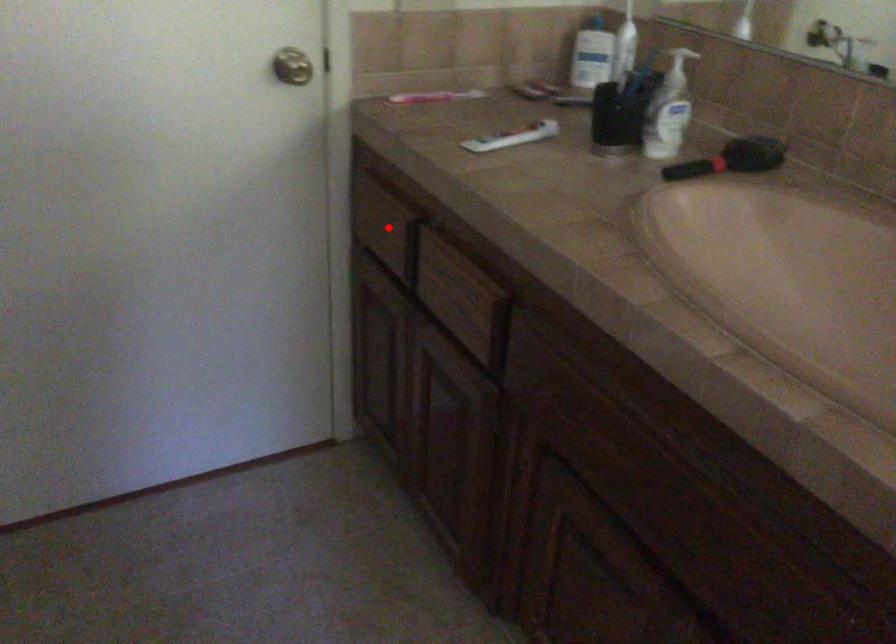
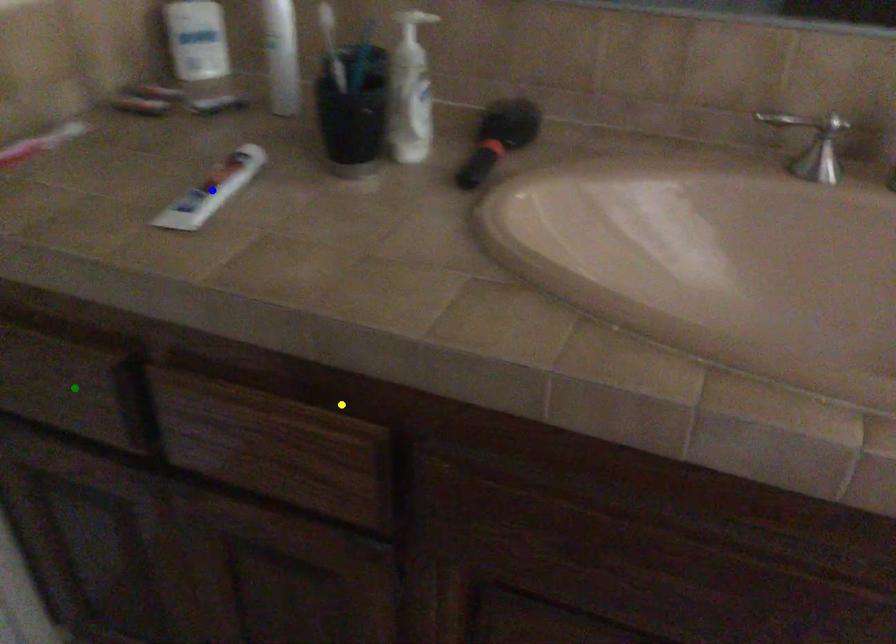
Question: I am providing you with two images of the same scene from different viewpoints. A red point is marked on the first image. You are given multiple points on the second image. In image 2, which mark is for the same physical point as the one in image 1?

Choices:
 (A) yellow point
 (B) blue point
 (C) green point

Answer: (C)